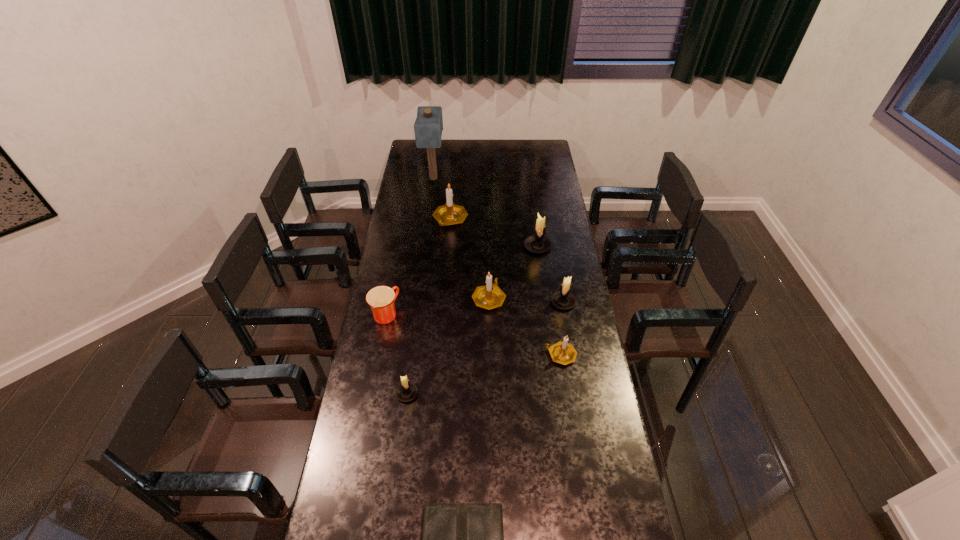
In order to click on candle holder that stands as the fifth closest to the shortest object in this screenshot , I will do `click(538, 243)`.

Where is `the second closest gold candle holder to the biggest gold candle holder`? This screenshot has width=960, height=540. the second closest gold candle holder to the biggest gold candle holder is located at coordinates tap(562, 352).

Locate an element on the screen. gold candle holder that is the third closest to the farthest white candle holder is located at coordinates (562, 352).

I want to click on the closest white candle holder to the rightmost gold candle holder, so click(563, 299).

Where is `white candle holder that stands as the closest to the fifth nearest candle holder`? The width and height of the screenshot is (960, 540). white candle holder that stands as the closest to the fifth nearest candle holder is located at coordinates (563, 299).

The width and height of the screenshot is (960, 540). In order to click on free space that satisfies the following two spatial constraints: 1. on the front side of the second farthest object; 2. on the left side of the seventh nearest object in this screenshot , I will do `click(448, 246)`.

Identify the location of vacant region that satisfies the following two spatial constraints: 1. on the front side of the fifth farthest candle holder; 2. on the left side of the fourth candle holder from right to left. (490, 355).